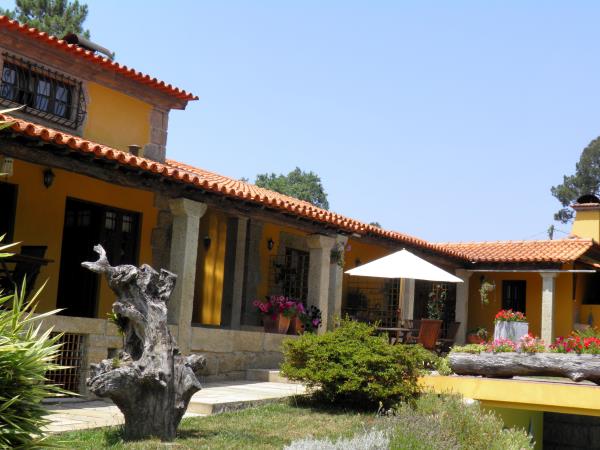
You are a GUI agent. You are given a task and a screenshot of the screen. Output one action in this format:
    pyautogui.click(x=<x>, y=<y>)
    Task: Click on the lights
    The height and width of the screenshot is (450, 600).
    Given the screenshot: What is the action you would take?
    pyautogui.click(x=272, y=249), pyautogui.click(x=52, y=183)